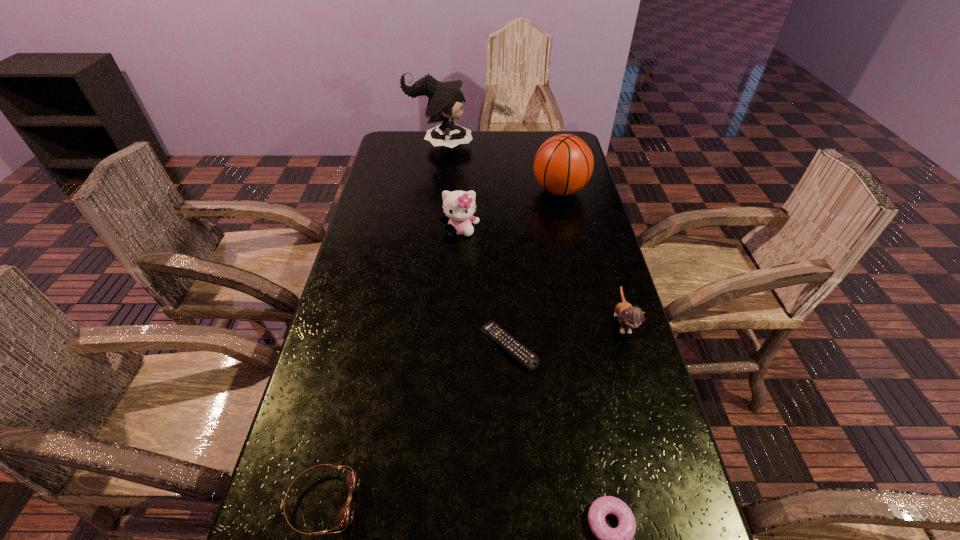
You are a GUI agent. You are given a task and a screenshot of the screen. Output one action in this format:
    pyautogui.click(x=<x>, y=<y>)
    Task: Click on the vacant point located between the doll and the fifth shortest object
    This screenshot has width=960, height=540.
    Given the screenshot: What is the action you would take?
    pyautogui.click(x=450, y=187)

Locate an element on the screen. The width and height of the screenshot is (960, 540). free space between the fourth tallest object and the remote control is located at coordinates (565, 335).

The height and width of the screenshot is (540, 960). Find the location of `vacant area between the basketball and the shortest object`. vacant area between the basketball and the shortest object is located at coordinates (534, 268).

This screenshot has width=960, height=540. What are the coordinates of `object that is the third closest one to the fifth nearest object` in the screenshot? It's located at (445, 101).

Point out which object is positioned as the fourth nearest to the shorter kitten. Please provide its 2D coordinates. Your answer should be formatted as a tuple, i.e. [(x, y)], where the tuple contains the x and y coordinates of a point satisfying the conditions above.

[(458, 206)]

Where is `vacant area in the image that satisfies the following two spatial constraints: 1. on the front-facing side of the shortest object; 2. on the left side of the third tallest object`? vacant area in the image that satisfies the following two spatial constraints: 1. on the front-facing side of the shortest object; 2. on the left side of the third tallest object is located at coordinates (454, 347).

Locate an element on the screen. vacant space that satisfies the following two spatial constraints: 1. on the front-facing side of the left kitten; 2. through the lenses of the fifth tallest object is located at coordinates (446, 502).

Locate an element on the screen. The image size is (960, 540). free space that satisfies the following two spatial constraints: 1. at the face of the farthest object; 2. on the left side of the sixth shortest object is located at coordinates (434, 191).

Where is `free location that satisfies the following two spatial constraints: 1. on the front-facing side of the shorter kitten; 2. through the lenses of the goggles`? This screenshot has height=540, width=960. free location that satisfies the following two spatial constraints: 1. on the front-facing side of the shorter kitten; 2. through the lenses of the goggles is located at coordinates (675, 502).

This screenshot has width=960, height=540. I want to click on blank space that satisfies the following two spatial constraints: 1. at the face of the farthest object; 2. on the back side of the fourth object from right to left, so click(x=414, y=347).